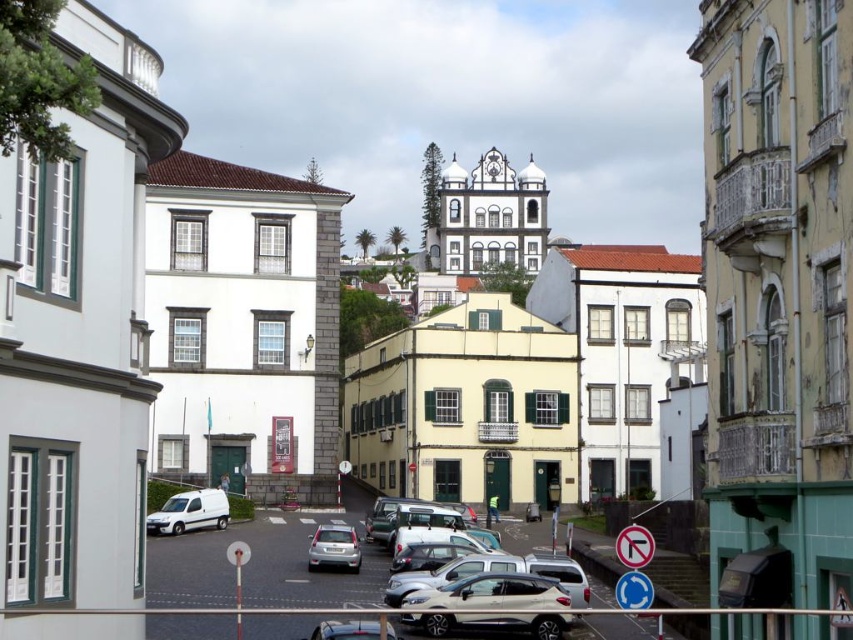
Which of these two, satin silver suv at center or white matte van at lower left, stands taller?

With more height is white matte van at lower left.

Locate an element on the screen. Image resolution: width=853 pixels, height=640 pixels. satin silver suv at center is located at coordinates (492, 605).

Identify the location of satin silver suv at center. (492, 605).

Does silver metallic car at center appear under satin silver car at center?

Correct, silver metallic car at center is located below satin silver car at center.

Is silver metallic car at center closer to camera compared to satin silver car at center?

Yes, it is in front of satin silver car at center.

Does point (390, 604) come behind point (312, 540)?

No.

Image resolution: width=853 pixels, height=640 pixels. I want to click on silver metallic car at center, so click(474, 570).

Consider the image. Is satin silver suv at center in front of metallic silver car at center?

No, it is behind metallic silver car at center.

Can you confirm if satin silver suv at center is positioned to the left of metallic silver car at center?

In fact, satin silver suv at center is to the right of metallic silver car at center.

Which is in front, point (432, 605) or point (390, 627)?

Point (390, 627)

Locate an element on the screen. The image size is (853, 640). satin silver suv at center is located at coordinates (492, 605).